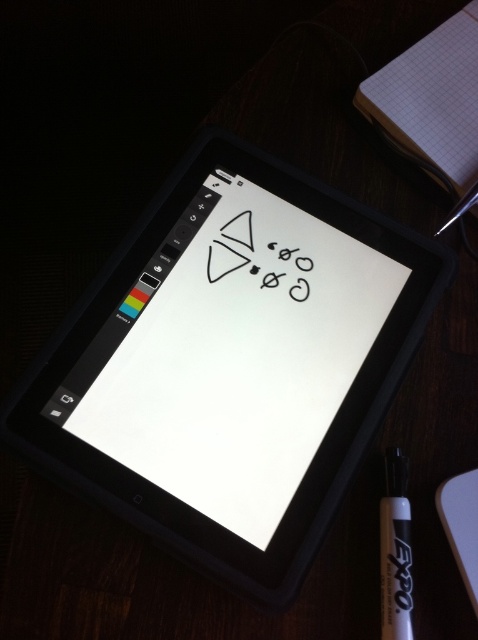
You are trying to locate the black plastic tablet at center on the dark wooden surface. What are the coordinates where you should look?

The black plastic tablet at center is located at coordinates point (231, 364).